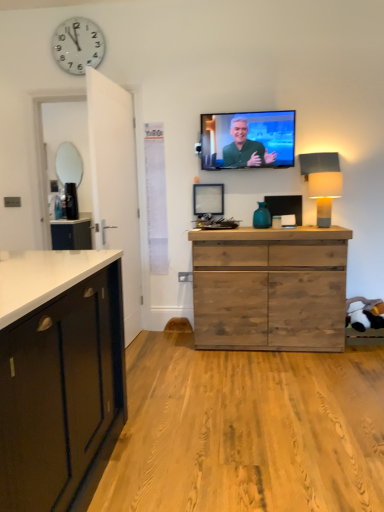
Locate an element on the screen. The image size is (384, 512). vacant area that lies in front of blue glass vase at center is located at coordinates (263, 230).